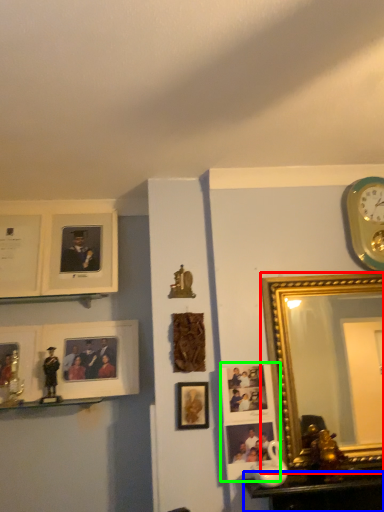
Question: Which object is positioned farthest from picture frame (highlighted by a red box)? Select from table (highlighted by a blue box) and picture frame (highlighted by a green box).

Choices:
 (A) table
 (B) picture frame

Answer: (A)